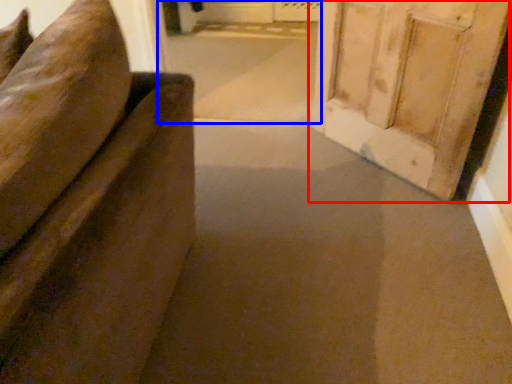
Question: Which object is closer to the camera taking this photo, door (highlighted by a red box) or passage (highlighted by a blue box)?

Choices:
 (A) door
 (B) passage

Answer: (A)